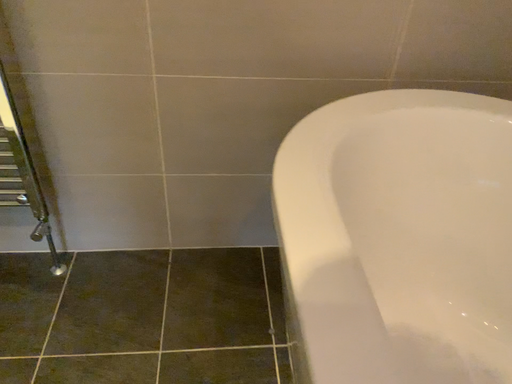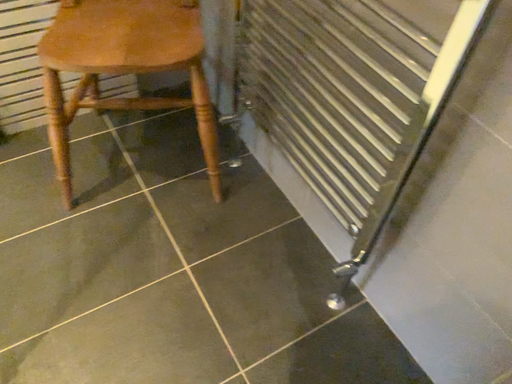
Question: How did the camera likely rotate when shooting the video?

Choices:
 (A) rotated right
 (B) rotated left

Answer: (B)